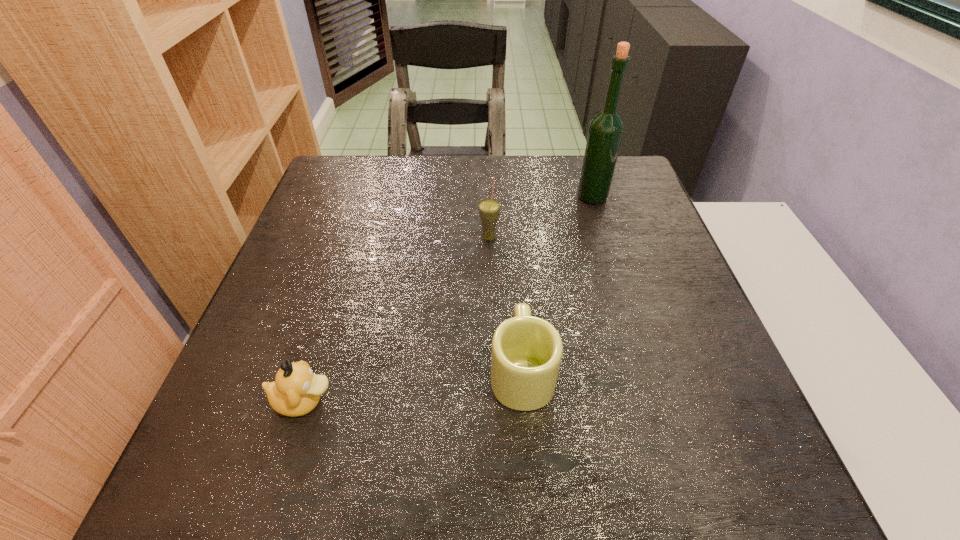
The height and width of the screenshot is (540, 960). I want to click on vacant space at the far left corner of the desktop, so click(373, 194).

Where is `empty space between the farthest object and the third shortest object`? Image resolution: width=960 pixels, height=540 pixels. empty space between the farthest object and the third shortest object is located at coordinates (540, 217).

Find the location of a particular element. The width and height of the screenshot is (960, 540). unoccupied area between the leftmost object and the second farthest object is located at coordinates pos(396,319).

The image size is (960, 540). In order to click on empty space that is in between the straw for drinking and the leftmost object in this screenshot , I will do `click(396, 319)`.

I want to click on free space between the third nearest object and the leftmost object, so click(396, 319).

You are a GUI agent. You are given a task and a screenshot of the screen. Output one action in this format:
    pyautogui.click(x=<x>, y=<y>)
    Task: Click on the vacant space that is in between the mug and the rightmost object
    This screenshot has width=960, height=540.
    Given the screenshot: What is the action you would take?
    557,284

What are the coordinates of `vacant area that lies between the leftmost object and the second tallest object` in the screenshot? It's located at (396, 319).

Locate an element on the screen. The width and height of the screenshot is (960, 540). vacant area that lies between the mug and the farthest object is located at coordinates (557, 284).

What are the coordinates of `free space between the duckling and the second tallest object` in the screenshot? It's located at (396, 319).

Identify the location of free space between the mug and the second farthest object. Image resolution: width=960 pixels, height=540 pixels. (505, 304).